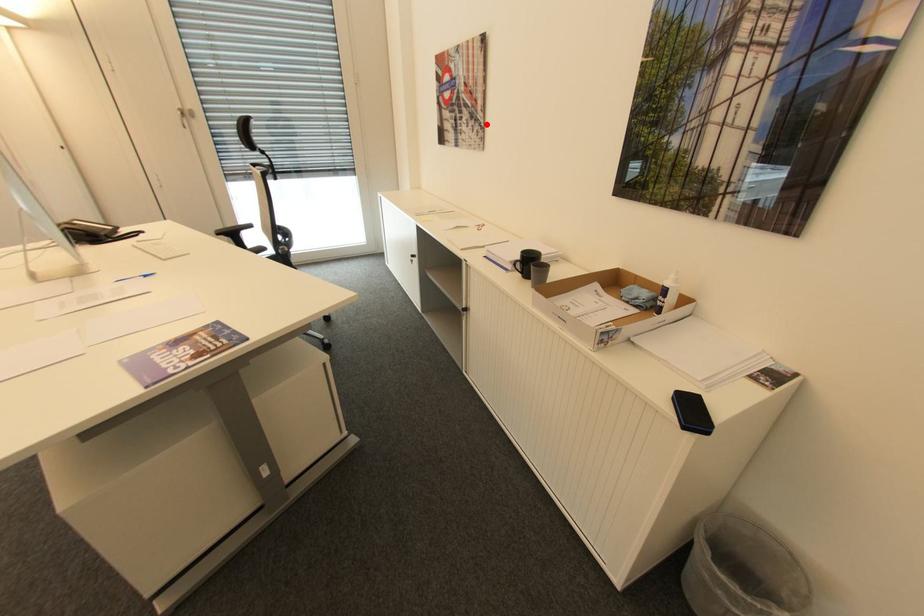
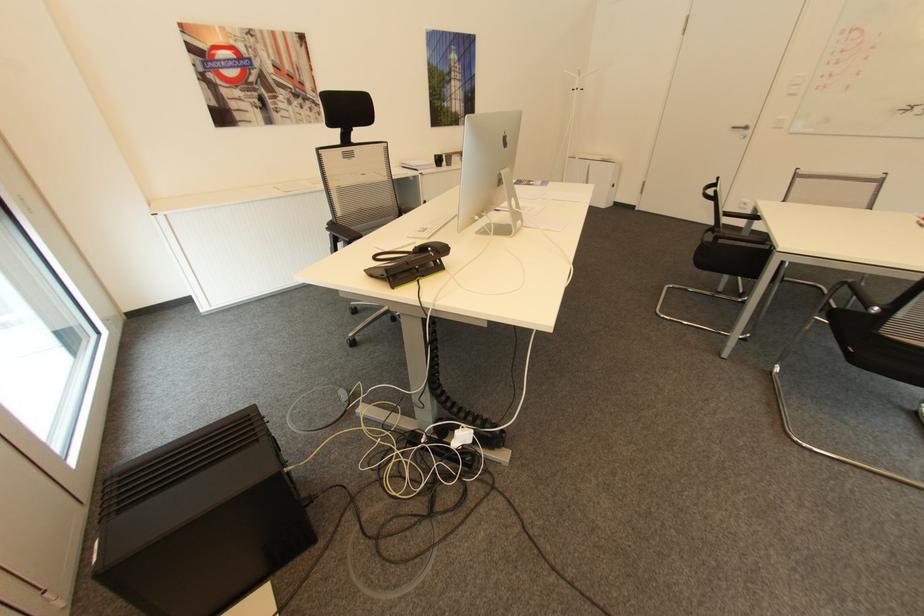
Find the pixel in the second image that matches the highlighted location in the first image.

(322, 102)